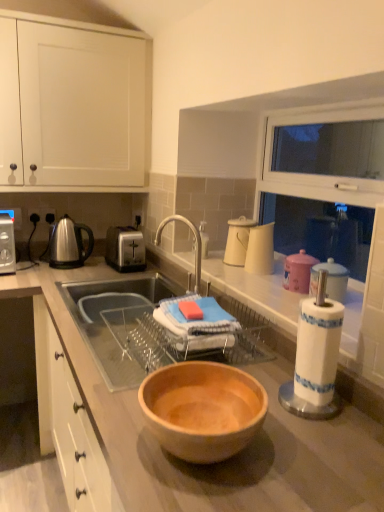
This screenshot has width=384, height=512. What do you see at coordinates (72, 104) in the screenshot?
I see `white matte cabinet at upper left, placed as the 1th cabinetry when sorted from left to right` at bounding box center [72, 104].

What do you see at coordinates (237, 241) in the screenshot?
I see `white glossy cups at upper center, the 1th appliance when ordered from back to front` at bounding box center [237, 241].

Identify the location of white matte cabinet at upper right, placed as the 1th cabinetry when sorted from right to left. Image resolution: width=384 pixels, height=512 pixels. (321, 175).

Measure the distance between shiny metallic kettle at left and camera.

6.88 feet.

What are the coordinates of `white matte cabinet at upper left, which is counted as the 2th cabinetry, starting from the right` in the screenshot? It's located at (72, 104).

Between white paper towel holder at right, arranged as the first appliance when viewed from the front, and white glossy pitcher at upper right, which appears as the second appliance when viewed from the front, which one has less height?

white paper towel holder at right, arranged as the first appliance when viewed from the front, is shorter.

Does white paper towel holder at right, the third appliance in the back-to-front sequence, turn towards white glossy pitcher at upper right, which appears as the second appliance when viewed from the front?

No, white paper towel holder at right, the third appliance in the back-to-front sequence, is not facing towards white glossy pitcher at upper right, which appears as the second appliance when viewed from the front.

From the image's perspective, relative to white glossy pitcher at upper right, which appears as the second appliance when viewed from the front, is white paper towel holder at right, arranged as the first appliance when viewed from the front, above or below?

Based on their image positions, white paper towel holder at right, arranged as the first appliance when viewed from the front, is located beneath white glossy pitcher at upper right, which appears as the second appliance when viewed from the front.

How many degrees apart are the facing directions of white paper towel holder at right, the third appliance in the back-to-front sequence, and white glossy pitcher at upper right, which is counted as the 2th appliance, starting from the back?

The angular difference between white paper towel holder at right, the third appliance in the back-to-front sequence, and white glossy pitcher at upper right, which is counted as the 2th appliance, starting from the back, is 3.42 degrees.

Does point (257, 243) appear closer or farther from the camera than point (327, 277)?

Clearly, point (257, 243) is more distant from the camera than point (327, 277).

Which is more to the right, white glossy pitcher at upper right, which is counted as the 2th appliance, starting from the back, or white paper towel holder at right, the third appliance in the back-to-front sequence?

white paper towel holder at right, the third appliance in the back-to-front sequence, is more to the right.

From the white paper towel holder at right, arranged as the first appliance when viewed from the front, count the 1st appliance to the left and point to it. Please provide its 2D coordinates.

[(260, 250)]

Is white glossy pitcher at upper right, which appears as the second appliance when viewed from the front, positioned beyond the bounds of white paper towel holder at right, the third appliance in the back-to-front sequence?

Indeed, white glossy pitcher at upper right, which appears as the second appliance when viewed from the front, is completely outside white paper towel holder at right, the third appliance in the back-to-front sequence.

Are wooden bowl at center and shiny metallic kettle at left far apart?

That's not correct — wooden bowl at center is a little close to shiny metallic kettle at left.

Is point (68, 335) closer to camera compared to point (66, 219)?

That is True.

From the image's perspective, who appears lower, wooden bowl at center or shiny metallic kettle at left?

wooden bowl at center, from the image's perspective.

Image resolution: width=384 pixels, height=512 pixels. In order to click on tea pot located above the wooden bowl at center (from the image's perspective) in this screenshot , I will do `click(69, 244)`.

Can you tell me how much white matte cabinet at upper right, the 2th cabinetry in the left-to-right sequence, and shiny metallic kettle at left differ in facing direction?

white matte cabinet at upper right, the 2th cabinetry in the left-to-right sequence, and shiny metallic kettle at left are facing 90.5 degrees away from each other.

From the image's perspective, would you say white matte cabinet at upper right, placed as the 1th cabinetry when sorted from right to left, is positioned over shiny metallic kettle at left?

Yes, from the image's perspective, white matte cabinet at upper right, placed as the 1th cabinetry when sorted from right to left, is on top of shiny metallic kettle at left.

Is white matte cabinet at upper right, the 2th cabinetry in the left-to-right sequence, wider than shiny metallic kettle at left?

No.

Is point (269, 143) more distant than point (64, 220)?

No, it is in front of (64, 220).

From a real-world perspective, is wooden bowl at center positioned under satin silver toaster at center based on gravity?

Correct, in the physical world, wooden bowl at center is lower than satin silver toaster at center.

At what (x,y) coordinates should I click in order to perform the action: click on toaster that is behind the wooden bowl at center. Please return your answer as a coordinate pair (x, y). The height and width of the screenshot is (512, 384). Looking at the image, I should click on (125, 249).

How much distance is there between wooden bowl at center and satin silver toaster at center?

wooden bowl at center and satin silver toaster at center are 15.44 inches apart.

Would you say wooden bowl at center is a long distance from satin silver toaster at center?

No, there isn't a large distance between wooden bowl at center and satin silver toaster at center.

Can you tell me how much white paper towel holder at right, the third appliance in the back-to-front sequence, and satin silver toaster at center differ in facing direction?

They differ by 94.6 degrees in their facing directions.

Which object is positioned more to the left, white paper towel holder at right, the third appliance in the back-to-front sequence, or satin silver toaster at center?

satin silver toaster at center.

Considering the relative sizes of white paper towel holder at right, arranged as the first appliance when viewed from the front, and satin silver toaster at center in the image provided, is white paper towel holder at right, arranged as the first appliance when viewed from the front, shorter than satin silver toaster at center?

Yes.

Based on the photo, which is in front, white paper towel holder at right, arranged as the first appliance when viewed from the front, or satin silver toaster at center?

Positioned in front is white paper towel holder at right, arranged as the first appliance when viewed from the front.

How many degrees apart are the facing directions of white glossy pitcher at upper right, which appears as the second appliance when viewed from the front, and shiny metallic kettle at left?

The angular difference between white glossy pitcher at upper right, which appears as the second appliance when viewed from the front, and shiny metallic kettle at left is 88.6 degrees.

Considering the relative positions of white glossy pitcher at upper right, which appears as the second appliance when viewed from the front, and shiny metallic kettle at left in the image provided, is white glossy pitcher at upper right, which appears as the second appliance when viewed from the front, to the left of shiny metallic kettle at left from the viewer's perspective?

In fact, white glossy pitcher at upper right, which appears as the second appliance when viewed from the front, is to the right of shiny metallic kettle at left.

Does point (272, 264) come farther from viewer compared to point (61, 262)?

No, it is not.

Is white glossy pitcher at upper right, which appears as the second appliance when viewed from the front, positioned in front of shiny metallic kettle at left?

That is True.

Find the location of a particular element. appliance in front of the white glossy pitcher at upper right, which appears as the second appliance when viewed from the front is located at coordinates (330, 280).

At what (x,y) coordinates should I click in order to perform the action: click on the 2nd appliance below the white glossy pitcher at upper right, which appears as the second appliance when viewed from the front (from a real-world perspective). Please return your answer as a coordinate pair (x, y). This screenshot has height=512, width=384. Looking at the image, I should click on (330, 280).

Based on their spatial positions, is satin silver toaster at center or wooden bowl at center further from white matte cabinet at upper left, placed as the 1th cabinetry when sorted from left to right?

wooden bowl at center is further to white matte cabinet at upper left, placed as the 1th cabinetry when sorted from left to right.

Estimate the real-world distances between objects in this image. Which object is closer to white glossy pitcher at upper right, which appears as the second appliance when viewed from the front, wooden bowl at center or shiny metallic kettle at left?

The object closer to white glossy pitcher at upper right, which appears as the second appliance when viewed from the front, is wooden bowl at center.

Looking at the image, which one is located closer to white matte cabinet at upper right, the 2th cabinetry in the left-to-right sequence, white glossy pitcher at upper right, which appears as the second appliance when viewed from the front, or wooden bowl at center?

The object closer to white matte cabinet at upper right, the 2th cabinetry in the left-to-right sequence, is white glossy pitcher at upper right, which appears as the second appliance when viewed from the front.

Considering their positions, is white matte cabinet at upper left, which is counted as the 2th cabinetry, starting from the right, positioned closer to white glossy cups at upper center, placed as the 3th appliance when sorted from front to back, than white matte cabinet at upper right, placed as the 1th cabinetry when sorted from right to left?

white matte cabinet at upper right, placed as the 1th cabinetry when sorted from right to left, lies closer to white glossy cups at upper center, placed as the 3th appliance when sorted from front to back, than the other object.

Considering their positions, is white paper towel holder at right, the third appliance in the back-to-front sequence, positioned closer to white glossy cups at upper center, the 1th appliance when ordered from back to front, than shiny metallic kettle at left?

white paper towel holder at right, the third appliance in the back-to-front sequence.

Looking at the image, which one is located further to white matte cabinet at upper left, which is counted as the 2th cabinetry, starting from the right, white paper towel holder at right, the third appliance in the back-to-front sequence, or white glossy pitcher at upper right, which is counted as the 2th appliance, starting from the back?

white paper towel holder at right, the third appliance in the back-to-front sequence, is further to white matte cabinet at upper left, which is counted as the 2th cabinetry, starting from the right.

From the image, which object appears to be farther from white matte cabinet at upper left, which is counted as the 2th cabinetry, starting from the right, white matte cabinet at upper right, the 2th cabinetry in the left-to-right sequence, or white glossy cups at upper center, the 1th appliance when ordered from back to front?

white glossy cups at upper center, the 1th appliance when ordered from back to front, is positioned further to the anchor white matte cabinet at upper left, which is counted as the 2th cabinetry, starting from the right.

Which object lies further to the anchor point wooden bowl at center, white matte cabinet at upper right, placed as the 1th cabinetry when sorted from right to left, or white matte cabinet at upper left, which is counted as the 2th cabinetry, starting from the right?

white matte cabinet at upper left, which is counted as the 2th cabinetry, starting from the right, is further to wooden bowl at center.

Where is `appliance between shiny metallic kettle at left and white glossy pitcher at upper right, which is counted as the 2th appliance, starting from the back`? This screenshot has width=384, height=512. appliance between shiny metallic kettle at left and white glossy pitcher at upper right, which is counted as the 2th appliance, starting from the back is located at coordinates (237, 241).

What are the coordinates of `cabinetry between shiny metallic kettle at left and white glossy pitcher at upper right, which appears as the second appliance when viewed from the front` in the screenshot? It's located at (72, 104).

The height and width of the screenshot is (512, 384). I want to click on appliance between white matte cabinet at upper right, placed as the 1th cabinetry when sorted from right to left, and white glossy cups at upper center, placed as the 3th appliance when sorted from front to back, from front to back, so click(x=260, y=250).

Image resolution: width=384 pixels, height=512 pixels. I want to click on toaster located between shiny metallic kettle at left and white matte cabinet at upper right, placed as the 1th cabinetry when sorted from right to left, in the left-right direction, so click(125, 249).